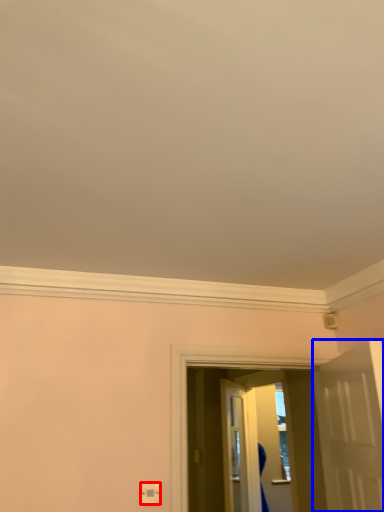
Question: Which of the following is the closest to the observer, electric outlet (highlighted by a red box) or door (highlighted by a blue box)?

Choices:
 (A) electric outlet
 (B) door

Answer: (B)